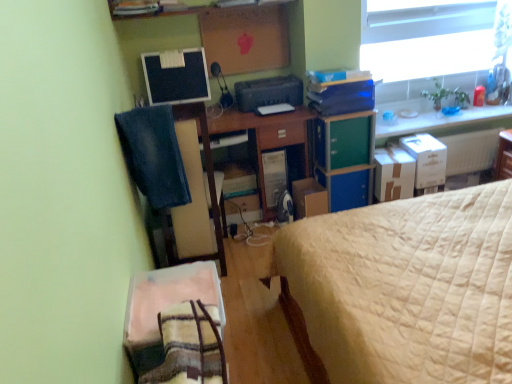
Locate an element on the screen. free spot above cardboard box at center, positioned as the 1th cardboard box in left-to-right order (from a real-world perspective) is located at coordinates (313, 184).